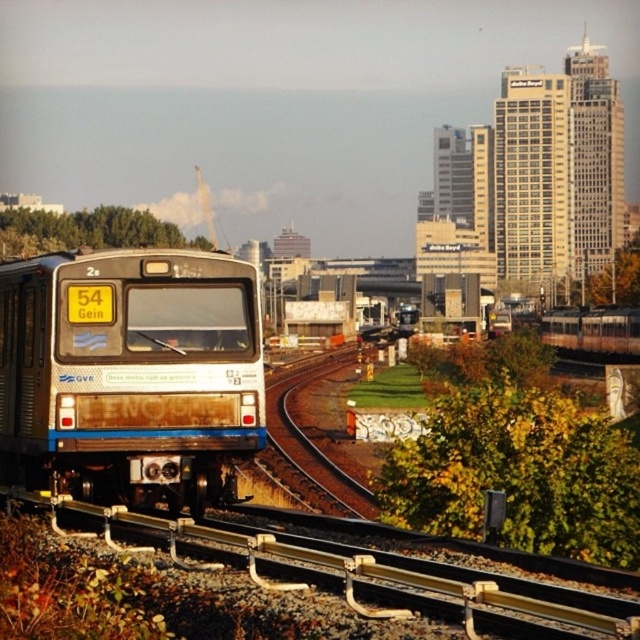
Question: Is rusty metal train at center thinner than brown metal rail at center?

Choices:
 (A) no
 (B) yes

Answer: (A)

Question: Does rusty metal train at center come behind brown metal rail at center?

Choices:
 (A) yes
 (B) no

Answer: (A)

Question: Can you confirm if rusty metal train at center is thinner than brown metal rail at center?

Choices:
 (A) yes
 (B) no

Answer: (B)

Question: Which point is closer to the camera?

Choices:
 (A) (176, 291)
 (B) (67, 506)

Answer: (B)

Question: Which of the following is the farthest from the observer?

Choices:
 (A) click(70, 436)
 (B) click(500, 602)

Answer: (A)